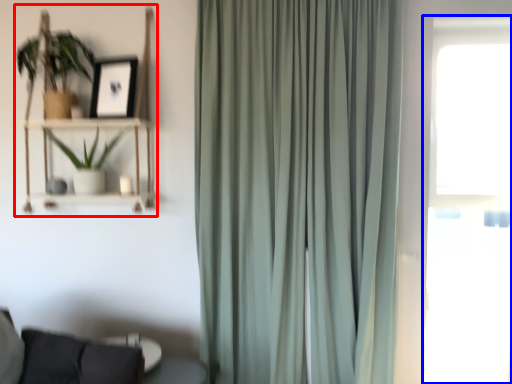
Question: Which point is further to the camera, bookshelf (highlighted by a red box) or window (highlighted by a blue box)?

Choices:
 (A) bookshelf
 (B) window

Answer: (A)